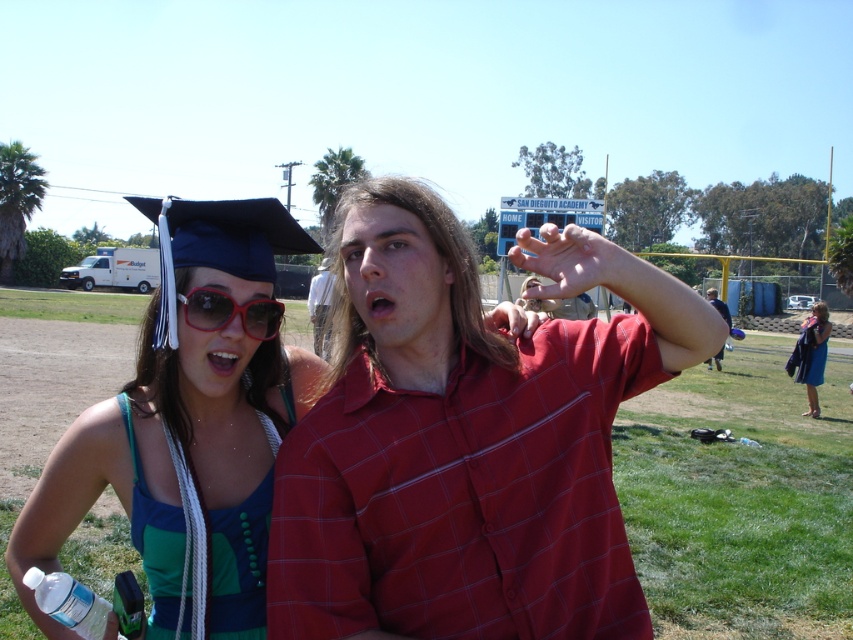
Question: Does red plastic sunglasses at center have a smaller size compared to matte red shirt at center?

Choices:
 (A) no
 (B) yes

Answer: (B)

Question: Among these objects, which one is farthest from the camera?

Choices:
 (A) red plaid shirt at center
 (B) matte blue graduation cap at upper left
 (C) red plastic sunglasses at center

Answer: (B)

Question: Which point is closer to the camera taking this photo?

Choices:
 (A) (805, 348)
 (B) (154, 580)
 (C) (822, 360)
 (D) (248, 330)

Answer: (D)

Question: In this image, where is matte blue graduation cap at upper left located relative to blue satin gown at lower right?

Choices:
 (A) left
 (B) right

Answer: (A)

Question: Does blue satin gown at lower right have a larger size compared to matte red shirt at center?

Choices:
 (A) no
 (B) yes

Answer: (A)

Question: Which point is farther to the camera?

Choices:
 (A) white cotton shirt at center
 (B) matte red shirt at center
 (C) matte blue graduation cap at upper left
 (D) red plastic sunglasses at center

Answer: (A)